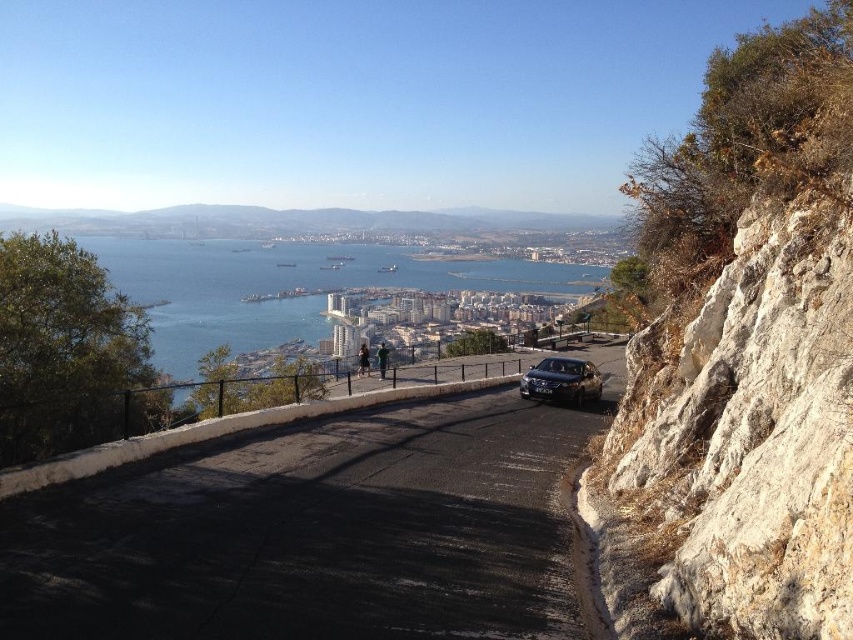
You are a hiker standing on the cliff overlooking the coastal city. You see the black asphalt road at center and the blue water at center. Which object is nearer to you?

The black asphalt road at center is closer to you than the blue water at center.

You are a hiker standing on the paved road and want to determine which object, the white rocky cliff at right or the blue water at center, is closer to you based on their positions in the scene. Which one is closer?

The white rocky cliff at right is closer to you than the blue water at center because it is positioned in the foreground of the scene.